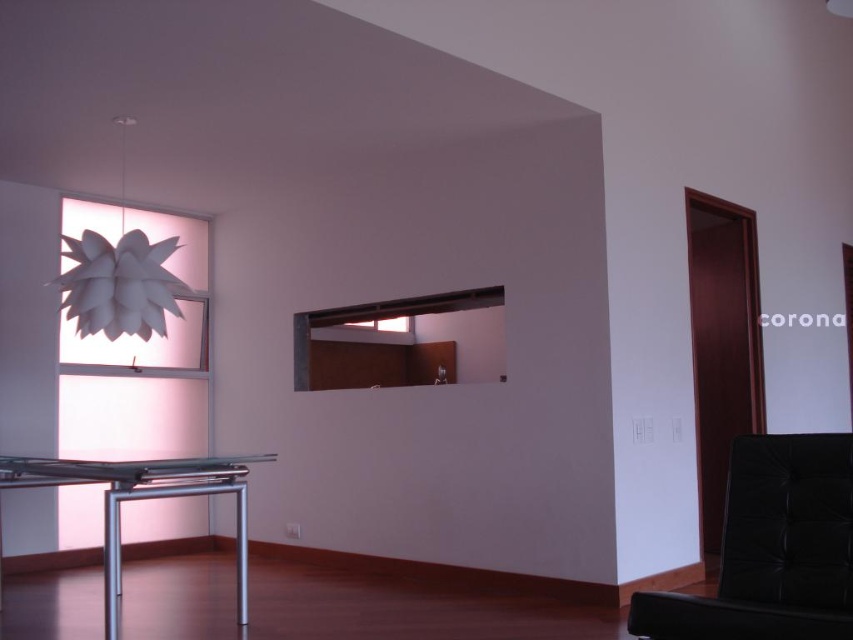
Question: Which object is positioned farthest from the silver metallic table at lower left?

Choices:
 (A) black leather armchair at lower right
 (B) white paper lamp at upper left

Answer: (A)

Question: Which point is farther to the camera?

Choices:
 (A) white paper lamp at upper left
 (B) silver metallic table at lower left

Answer: (A)

Question: Which of these objects is positioned farthest from the silver metallic table at lower left?

Choices:
 (A) black leather armchair at lower right
 (B) white paper lamp at upper left

Answer: (A)

Question: Can you confirm if black leather armchair at lower right is positioned below white paper lamp at upper left?

Choices:
 (A) yes
 (B) no

Answer: (A)

Question: Can you confirm if black leather armchair at lower right is positioned above silver metallic table at lower left?

Choices:
 (A) yes
 (B) no

Answer: (A)

Question: Is silver metallic table at lower left thinner than white paper lamp at upper left?

Choices:
 (A) yes
 (B) no

Answer: (B)